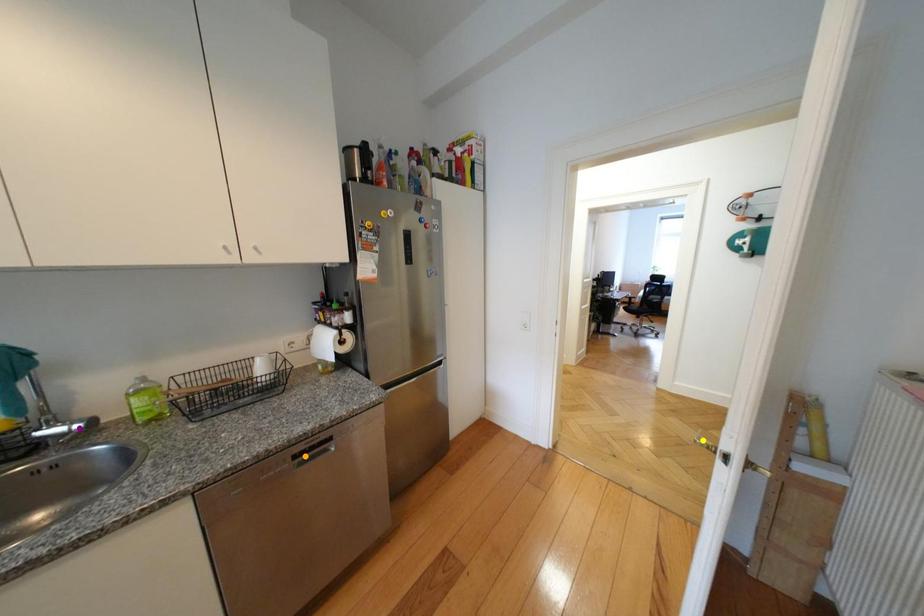
Order these from farthest to nearest:
orange point
purple point
yellow point

yellow point
orange point
purple point